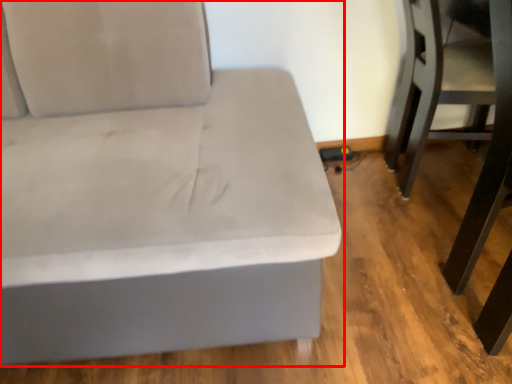
Question: From the image's perspective, where is studio couch (annotated by the red box) located relative to swivel chair?

Choices:
 (A) below
 (B) above

Answer: (A)